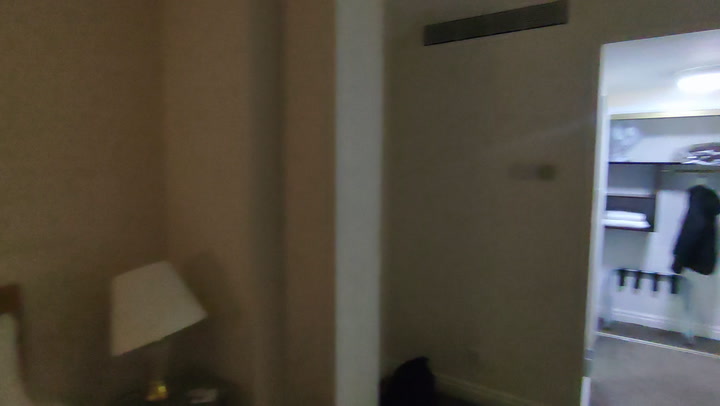
Identify the location of baseboard. (485, 394).